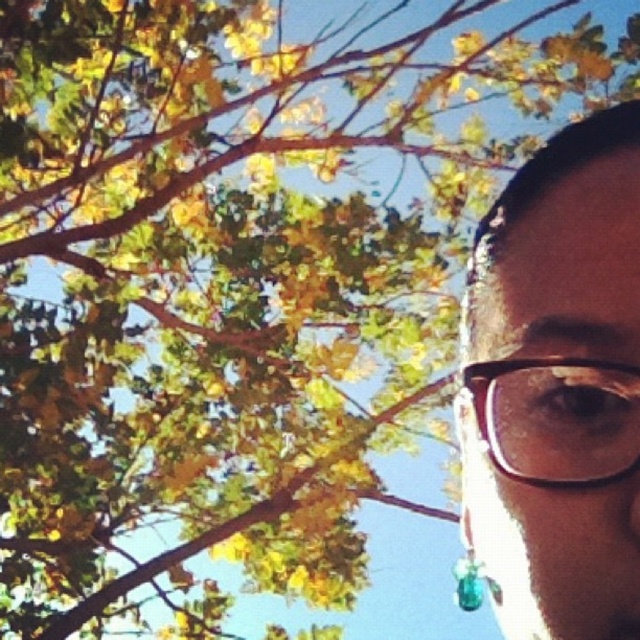
You are an artist sketching the scene and want to place the brown matte glasses at right accurately. According to the coordinates provided, where should you position them on your drawing canvas that uses a coordinate system where the bottom left corner is the origin?

The brown matte glasses at right should be positioned at coordinates approximately 0.605 on the x axis and 0.872 on the y axis, which corresponds to the upper right quadrant of the canvas.

You are holding a 12 inch ruler and want to measure the distance between your eyes and the point at coordinates point (547, 632) in the image. Can you fit the ruler between your eyes and the point?

The distance between the viewer and point (547, 632) is 16.51 inches, so yes, the 12 inch ruler can fit between your eyes and the point since it is shorter than the distance.

You are a photographer trying to focus on the brown matte glasses at right in the image. The camera shows a point at coordinates [557,387]. Is this point likely the center of the brown matte glasses at right?

Yes, the point [557,387] marks the center of the brown matte glasses at right.